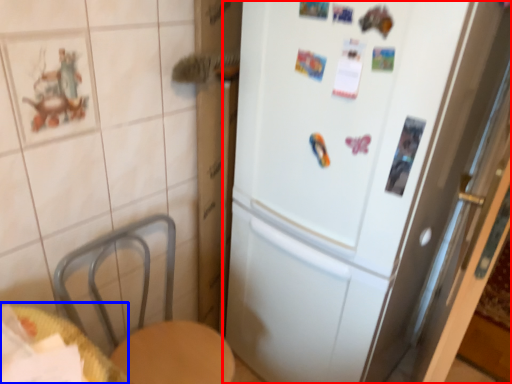
Question: Which object appears farthest to the camera in this image, refrigerator (highlighted by a red box) or table (highlighted by a blue box)?

Choices:
 (A) refrigerator
 (B) table

Answer: (A)